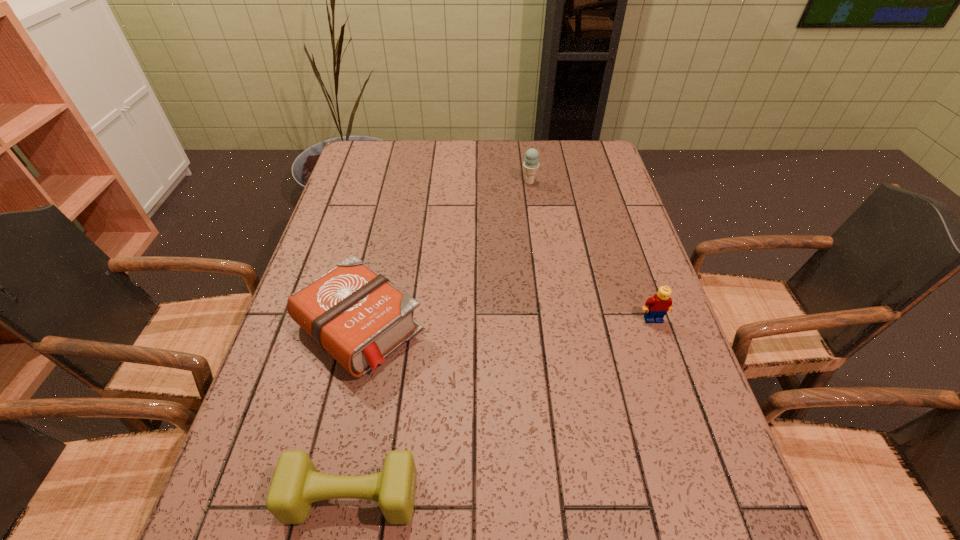
This screenshot has width=960, height=540. Identify the location of ice cream. (530, 165).

The image size is (960, 540). I want to click on the farthest object, so click(530, 165).

Locate an element on the screen. Lego is located at coordinates (660, 303).

At what (x,y) coordinates should I click in order to perform the action: click on Bible. Please return your answer as a coordinate pair (x, y). Looking at the image, I should click on (358, 316).

Identify the location of the nearest object. (296, 484).

This screenshot has height=540, width=960. Find the location of `vacant space located 0.380m on the front of the ice cream`. vacant space located 0.380m on the front of the ice cream is located at coordinates (541, 269).

The width and height of the screenshot is (960, 540). In order to click on blank space located on the front-facing side of the Lego in this screenshot , I will do (669, 367).

The width and height of the screenshot is (960, 540). Identify the location of vacant space situated on the back of the Bible. (392, 191).

Image resolution: width=960 pixels, height=540 pixels. What are the coordinates of `vacant space located 0.180m on the right of the nearest object` in the screenshot? It's located at (517, 497).

Image resolution: width=960 pixels, height=540 pixels. Identify the location of Bible present at the left edge. (358, 316).